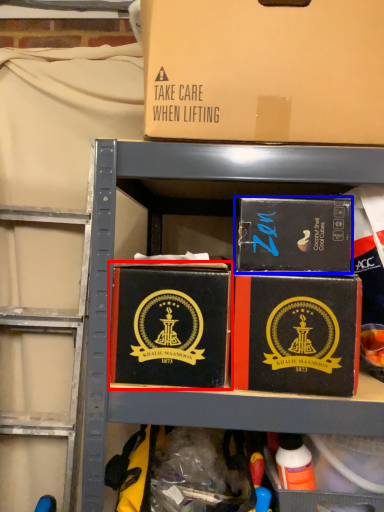
Question: Among these objects, which one is nearest to the camera, box (highlighted by a red box) or box (highlighted by a blue box)?

Choices:
 (A) box
 (B) box

Answer: (A)